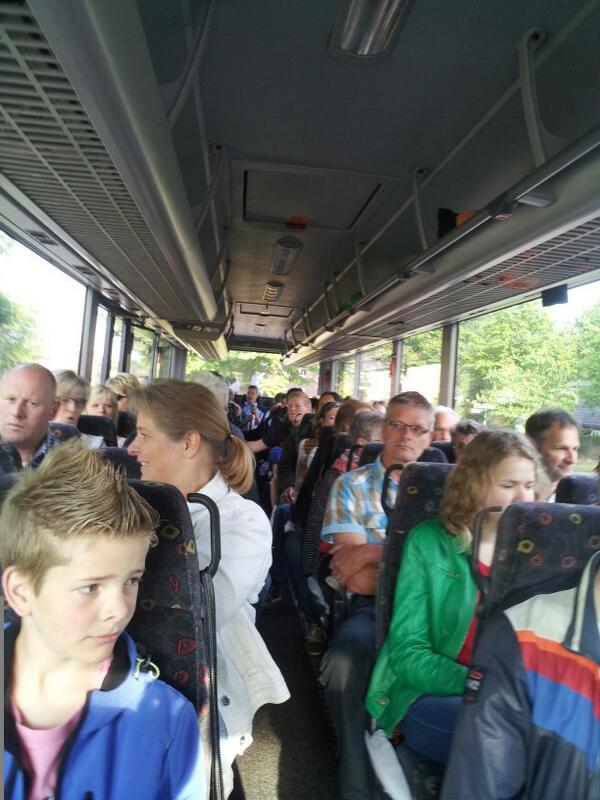
Image resolution: width=600 pixels, height=800 pixels. In order to click on windows in this screenshot , I will do `click(26, 310)`, `click(90, 350)`, `click(142, 353)`, `click(385, 372)`, `click(426, 353)`, `click(530, 360)`.